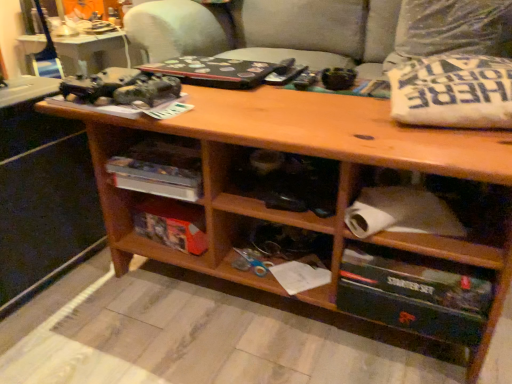
The width and height of the screenshot is (512, 384). I want to click on black cardboard starter set at lower right, so click(x=414, y=293).

Identify the location of white cotton pillow at upper right, arranged as the 2th pillow when viewed from the back. (453, 92).

In the scene shown: In order to face wooden shelf at center, should I rotate leftwards or rightwards?

To align with it, rotate left about 10.994°.

Find the location of a particular element. This screenshot has height=384, width=512. white paper at lower right is located at coordinates (450, 249).

Locate an element on the screen. This screenshot has width=512, height=384. orange cardboard box at center is located at coordinates (170, 224).

Identify the location of white fabric pillow at upper right, acting as the first pillow starting from the top. (451, 29).

This screenshot has height=384, width=512. Find the location of `black cardboard starter set at lower right`. black cardboard starter set at lower right is located at coordinates (414, 293).

From the image's perspective, which one is positioned lower, white cotton pillow at upper right, placed as the 1th pillow when sorted from front to back, or orange cardboard box at center?

orange cardboard box at center.

Between white cotton pillow at upper right, placed as the 1th pillow when sorted from front to back, and orange cardboard box at center, which one is positioned in front?

white cotton pillow at upper right, placed as the 1th pillow when sorted from front to back.

Is white cotton pillow at upper right, arranged as the 2th pillow when viewed from the top, taller or shorter than orange cardboard box at center?

In the image, white cotton pillow at upper right, arranged as the 2th pillow when viewed from the top, appears to be taller than orange cardboard box at center.

Considering the relative sizes of white cotton pillow at upper right, which is the first pillow in bottom-to-top order, and orange cardboard box at center in the image provided, is white cotton pillow at upper right, which is the first pillow in bottom-to-top order, wider than orange cardboard box at center?

Yes, white cotton pillow at upper right, which is the first pillow in bottom-to-top order, is wider than orange cardboard box at center.

From the image's perspective, is black cardboard starter set at lower right on white cotton pillow at upper right, placed as the 1th pillow when sorted from front to back?

No, from the image's perspective, black cardboard starter set at lower right is not on top of white cotton pillow at upper right, placed as the 1th pillow when sorted from front to back.

Considering the relative positions of black cardboard starter set at lower right and white cotton pillow at upper right, arranged as the 2th pillow when viewed from the top, in the image provided, is black cardboard starter set at lower right to the left of white cotton pillow at upper right, arranged as the 2th pillow when viewed from the top, from the viewer's perspective?

Indeed, black cardboard starter set at lower right is positioned on the left side of white cotton pillow at upper right, arranged as the 2th pillow when viewed from the top.

Who is taller, black cardboard starter set at lower right or white cotton pillow at upper right, arranged as the 2th pillow when viewed from the back?

With more height is black cardboard starter set at lower right.

Which is in front, point (461, 301) or point (481, 73)?

The point (461, 301) is more forward.

Could you tell me if wooden shelf at center is facing white fabric pillow at upper right, acting as the first pillow starting from the top?

No, wooden shelf at center does not turn towards white fabric pillow at upper right, acting as the first pillow starting from the top.

Does wooden shelf at center have a larger size compared to white fabric pillow at upper right, acting as the first pillow starting from the top?

No.

Is wooden shelf at center completely or partially outside of white fabric pillow at upper right, acting as the first pillow starting from the top?

Absolutely, wooden shelf at center is external to white fabric pillow at upper right, acting as the first pillow starting from the top.

Consider the image. Can you confirm if orange cardboard box at center is smaller than white paper at lower right?

Yes, orange cardboard box at center is smaller than white paper at lower right.

Could you tell me if orange cardboard box at center is turned towards white paper at lower right?

No, orange cardboard box at center does not turn towards white paper at lower right.

Is point (144, 200) closer to camera compared to point (494, 258)?

No.

From a real-world perspective, is orange cardboard box at center below white paper at lower right?

Yes, from a real-world perspective, orange cardboard box at center is beneath white paper at lower right.

Could you tell me if white fabric pillow at upper right, placed as the 2th pillow when sorted from front to back, is turned towards wooden shelf at center?

Yes, white fabric pillow at upper right, placed as the 2th pillow when sorted from front to back, is turned towards wooden shelf at center.

Image resolution: width=512 pixels, height=384 pixels. I want to click on pillow that is the 2nd object located above the wooden shelf at center (from the image's perspective), so click(x=451, y=29).

How distant is white fabric pillow at upper right, placed as the second pillow when sorted from bottom to top, from wooden shelf at center?

They are 1.28 meters apart.

Is white fabric pillow at upper right, acting as the first pillow starting from the top, not close to wooden shelf at center?

Absolutely, white fabric pillow at upper right, acting as the first pillow starting from the top, is distant from wooden shelf at center.

Is white cotton pillow at upper right, arranged as the 2th pillow when viewed from the back, positioned far away from white paper at lower right?

Actually, white cotton pillow at upper right, arranged as the 2th pillow when viewed from the back, and white paper at lower right are a little close together.

Does white cotton pillow at upper right, placed as the 1th pillow when sorted from front to back, have a smaller size compared to white paper at lower right?

Actually, white cotton pillow at upper right, placed as the 1th pillow when sorted from front to back, might be larger than white paper at lower right.

Is white cotton pillow at upper right, placed as the 1th pillow when sorted from front to back, aimed at white paper at lower right?

No, white cotton pillow at upper right, placed as the 1th pillow when sorted from front to back, does not turn towards white paper at lower right.

Choose the correct answer: Is white cotton pillow at upper right, placed as the 1th pillow when sorted from front to back, inside white paper at lower right or outside it?

white cotton pillow at upper right, placed as the 1th pillow when sorted from front to back, exists outside the volume of white paper at lower right.

Is point (201, 254) closer to viewer compared to point (422, 80)?

That is False.

Considering the sizes of orange cardboard box at center and white cotton pillow at upper right, arranged as the 2th pillow when viewed from the back, in the image, is orange cardboard box at center bigger or smaller than white cotton pillow at upper right, arranged as the 2th pillow when viewed from the back,?

Clearly, orange cardboard box at center is smaller in size than white cotton pillow at upper right, arranged as the 2th pillow when viewed from the back.

Would you consider orange cardboard box at center to be distant from white cotton pillow at upper right, arranged as the 2th pillow when viewed from the top?

orange cardboard box at center is near white cotton pillow at upper right, arranged as the 2th pillow when viewed from the top, not far away.

Where is `box located behind the white cotton pillow at upper right, which is the first pillow in bottom-to-top order`? The width and height of the screenshot is (512, 384). box located behind the white cotton pillow at upper right, which is the first pillow in bottom-to-top order is located at coordinates (170, 224).

Find the location of a particular element. the 1st pillow counting from the right of the black cardboard starter set at lower right is located at coordinates (453, 92).

Which object lies nearer to the anchor point black cardboard starter set at lower right, white cotton pillow at upper right, placed as the 1th pillow when sorted from front to back, or orange cardboard box at center?

The object closer to black cardboard starter set at lower right is white cotton pillow at upper right, placed as the 1th pillow when sorted from front to back.

Looking at the image, which one is located further to white fabric pillow at upper right, acting as the first pillow starting from the top, black cardboard starter set at lower right or wooden shelf at center?

wooden shelf at center lies further to white fabric pillow at upper right, acting as the first pillow starting from the top, than the other object.

Estimate the real-world distances between objects in this image. Which object is closer to wooden shelf at center, white cotton pillow at upper right, placed as the 1th pillow when sorted from front to back, or orange cardboard box at center?

orange cardboard box at center is closer to wooden shelf at center.

When comparing their distances from white fabric pillow at upper right, placed as the second pillow when sorted from bottom to top, does black cardboard starter set at lower right or orange cardboard box at center seem closer?

Among the two, black cardboard starter set at lower right is located nearer to white fabric pillow at upper right, placed as the second pillow when sorted from bottom to top.

Based on their spatial positions, is white fabric pillow at upper right, acting as the first pillow starting from the top, or white cotton pillow at upper right, which is the first pillow in bottom-to-top order, further from orange cardboard box at center?

The object further to orange cardboard box at center is white fabric pillow at upper right, acting as the first pillow starting from the top.

When comparing their distances from black cardboard starter set at lower right, does wooden shelf at center or white fabric pillow at upper right, placed as the 2th pillow when sorted from front to back, seem further?

Among the two, white fabric pillow at upper right, placed as the 2th pillow when sorted from front to back, is located further to black cardboard starter set at lower right.

Based on their spatial positions, is white paper at lower right or white fabric pillow at upper right, placed as the second pillow when sorted from bottom to top, closer to wooden shelf at center?

white paper at lower right lies closer to wooden shelf at center than the other object.

Which object lies further to the anchor point wooden shelf at center, white fabric pillow at upper right, placed as the second pillow when sorted from bottom to top, or white paper at lower right?

white fabric pillow at upper right, placed as the second pillow when sorted from bottom to top.

I want to click on cabinet between orange cardboard box at center and black cardboard starter set at lower right, so click(450, 249).

Identify the location of drawer between white cotton pillow at upper right, placed as the 1th pillow when sorted from front to back, and white fabric pillow at upper right, placed as the second pillow when sorted from bottom to top, along the z-axis. (414, 293).

Image resolution: width=512 pixels, height=384 pixels. What are the coordinates of `drawer between orange cardboard box at center and white fabric pillow at upper right, placed as the 2th pillow when sorted from front to back, from left to right` in the screenshot? It's located at (414, 293).

You are a GUI agent. You are given a task and a screenshot of the screen. Output one action in this format:
    pyautogui.click(x=<x>, y=<y>)
    Task: Click on the cabinet situated between orange cardboard box at center and white cotton pillow at upper right, arranged as the 2th pillow when viewed from the back, from left to right
    This screenshot has height=384, width=512.
    Given the screenshot: What is the action you would take?
    pyautogui.click(x=450, y=249)